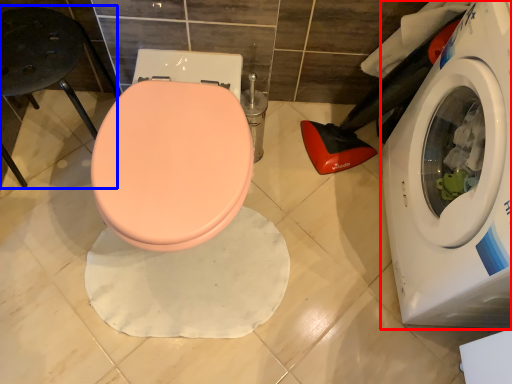
Question: Which object is closer to the camera taking this photo, washing machine (highlighted by a red box) or bar stool (highlighted by a blue box)?

Choices:
 (A) washing machine
 (B) bar stool

Answer: (A)